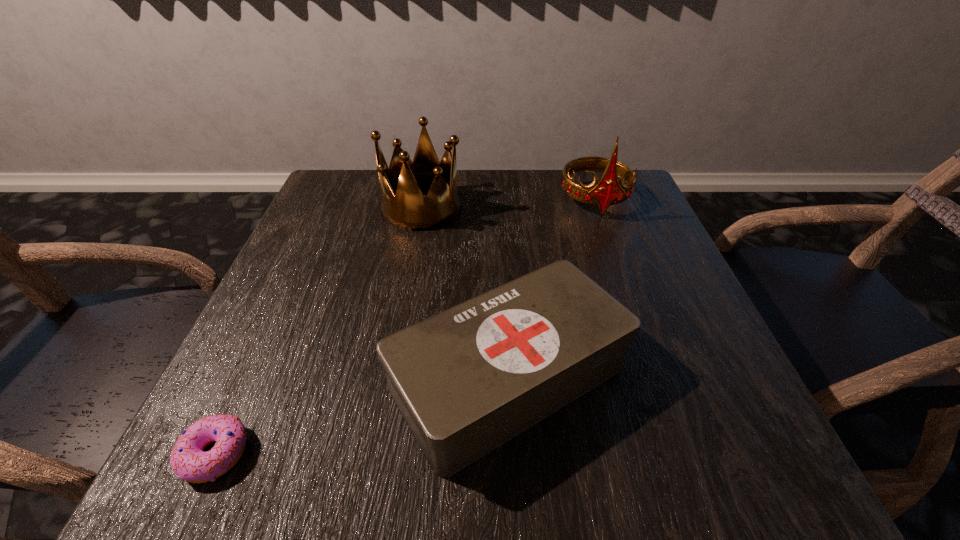
Find the location of a particular element. crown that is at the far edge is located at coordinates (401, 204).

This screenshot has height=540, width=960. Identify the location of the first-aid kit positioned at the near edge. (466, 380).

Find the location of `doughnut that is at the near edge`. doughnut that is at the near edge is located at coordinates (188, 461).

The height and width of the screenshot is (540, 960). I want to click on crown that is positioned at the left edge, so click(x=401, y=204).

The width and height of the screenshot is (960, 540). I want to click on doughnut that is at the left edge, so click(188, 461).

Find the location of a particular element. The width and height of the screenshot is (960, 540). object that is at the right edge is located at coordinates (607, 191).

The height and width of the screenshot is (540, 960). In order to click on object located at the far left corner in this screenshot , I will do `click(401, 204)`.

Find the location of `object at the near left corner`. object at the near left corner is located at coordinates (188, 461).

Image resolution: width=960 pixels, height=540 pixels. Identify the location of object located in the far right corner section of the desktop. (607, 191).

Locate an element on the screen. free space at the far edge of the desktop is located at coordinates (522, 217).